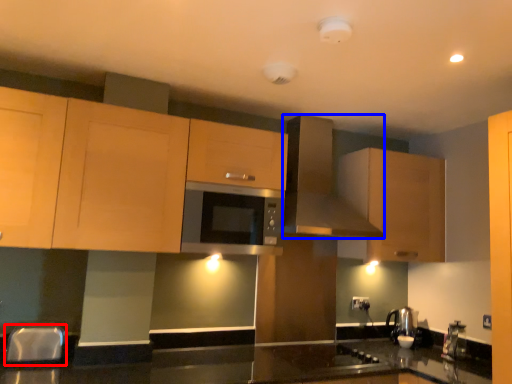
Question: Which object is closer to the camera taking this photo, silver (highlighted by a red box) or kitchen appliance (highlighted by a blue box)?

Choices:
 (A) silver
 (B) kitchen appliance

Answer: (A)